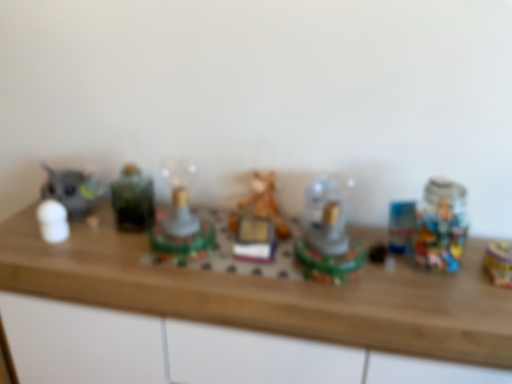
This screenshot has height=384, width=512. I want to click on free space to the left of gold metallic toy at right, the 7th toy positioned from the left, so click(444, 277).